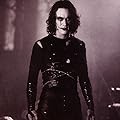
Identify the location of lighting. This screenshot has width=120, height=120. (12, 18), (44, 11), (117, 88), (115, 101).